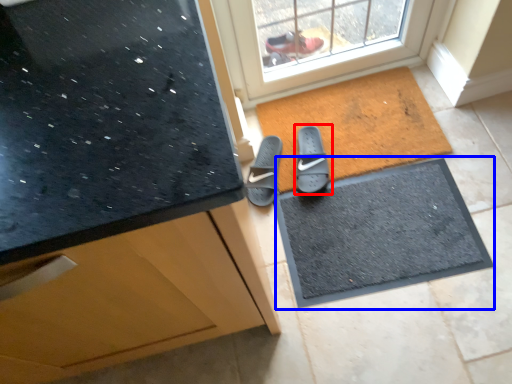
Question: Which object is closer to the camera taking this photo, footwear (highlighted by a red box) or doormat (highlighted by a blue box)?

Choices:
 (A) footwear
 (B) doormat

Answer: (B)